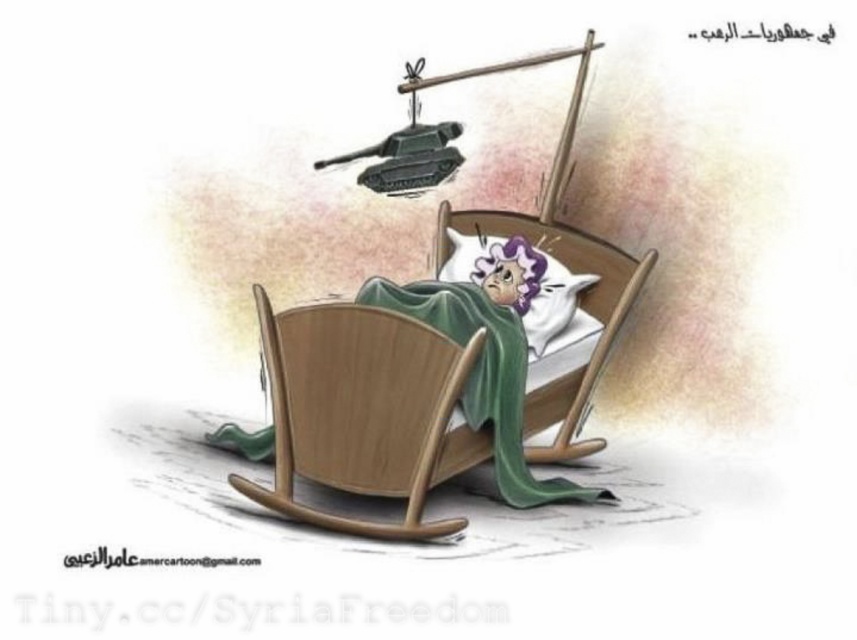
Is green soft blanket at center below white soft pillow at center?

Yes, green soft blanket at center is below white soft pillow at center.

Between point (478, 396) and point (458, 272), which one is positioned behind?

Positioned behind is point (458, 272).

Locate an element on the screen. The width and height of the screenshot is (857, 640). green soft blanket at center is located at coordinates (484, 376).

Between wooden rocking chair at center and green soft blanket at center, which one appears on the right side from the viewer's perspective?

Positioned to the right is green soft blanket at center.

Does wooden rocking chair at center appear on the left side of green soft blanket at center?

Yes, wooden rocking chair at center is to the left of green soft blanket at center.

The width and height of the screenshot is (857, 640). Identify the location of wooden rocking chair at center. (363, 412).

Measure the distance from wooden rocking chair at center to white soft pillow at center.

They are 5.13 inches apart.

Which is more to the left, wooden rocking chair at center or white soft pillow at center?

wooden rocking chair at center

Find the location of a particular element. wooden rocking chair at center is located at coordinates (363, 412).